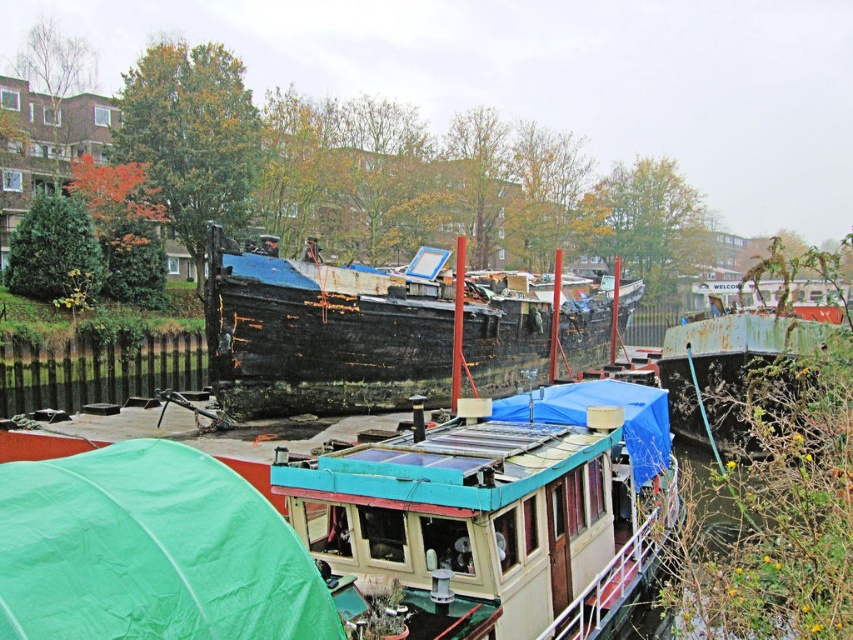
Which is more to the right, green fabric tent at lower left or rusty metal boat at center?

rusty metal boat at center is more to the right.

Is point (62, 552) more distant than point (579, 342)?

No, it is in front of (579, 342).

Is point (112, 602) positioned before point (363, 390)?

Yes, it is.

Where is `green fabric tent at lower left`? The image size is (853, 640). green fabric tent at lower left is located at coordinates (149, 552).

Is point (396, 586) more distant than point (239, 268)?

No, it is in front of (239, 268).

Can you confirm if teal plastic boat at center is bigger than rusty metal boat at center?

No.

Is point (647, 476) less distant than point (444, 250)?

That is True.

Where is `teal plastic boat at center`? The image size is (853, 640). teal plastic boat at center is located at coordinates (495, 512).

Does green fabric tent at lower left appear over rusty metal boat at center-right?

No, green fabric tent at lower left is not above rusty metal boat at center-right.

Which of these two, green fabric tent at lower left or rusty metal boat at center-right, stands shorter?

Standing shorter between the two is green fabric tent at lower left.

Image resolution: width=853 pixels, height=640 pixels. What do you see at coordinates (149, 552) in the screenshot? I see `green fabric tent at lower left` at bounding box center [149, 552].

You are a GUI agent. You are given a task and a screenshot of the screen. Output one action in this format:
    pyautogui.click(x=<x>, y=<y>)
    Task: Click on the green fabric tent at lower left
    This screenshot has height=640, width=853.
    Given the screenshot: What is the action you would take?
    pyautogui.click(x=149, y=552)